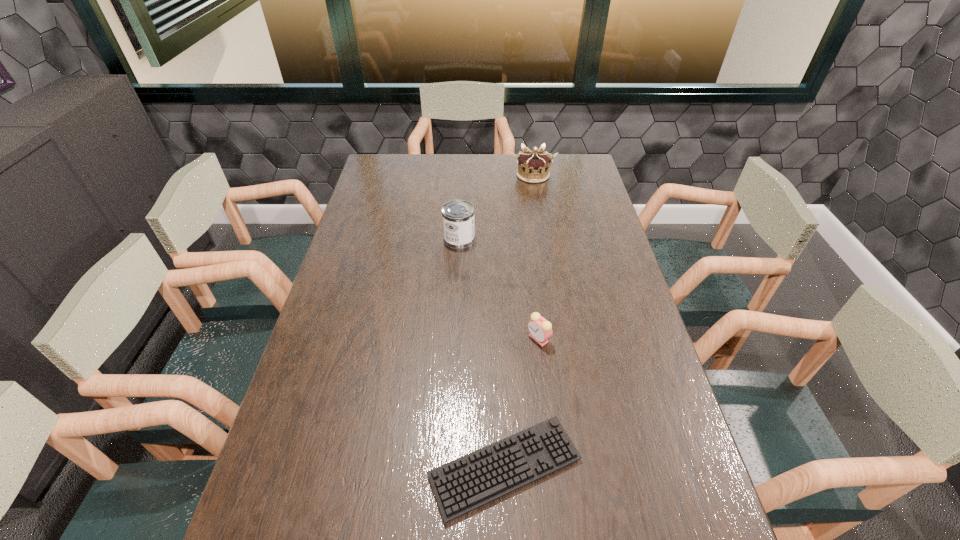
You are a GUI agent. You are given a task and a screenshot of the screen. Output one action in this format:
    pyautogui.click(x=<x>, y=<y>)
    Task: Click on the unoccupied area between the alarm clock and the third nearest object
    The height and width of the screenshot is (540, 960).
    Given the screenshot: What is the action you would take?
    pyautogui.click(x=499, y=289)

Find the location of a particular element. The image size is (960, 540). vacant area that lies between the can and the farthest object is located at coordinates (496, 207).

Locate an element on the screen. free space between the computer keyboard and the alarm clock is located at coordinates (522, 403).

Locate an element on the screen. Image resolution: width=960 pixels, height=540 pixels. vacant area that lies between the third nearest object and the crown is located at coordinates (496, 207).

This screenshot has height=540, width=960. What are the coordinates of `vacant area between the second nearest object and the second farthest object` in the screenshot? It's located at (499, 289).

In order to click on vacant space that is in between the farthest object and the nearest object in this screenshot , I will do `click(519, 321)`.

Where is `free spot between the crown and the alarm clock`? free spot between the crown and the alarm clock is located at coordinates (536, 256).

Where is `vacant area between the can and the third tallest object`? The height and width of the screenshot is (540, 960). vacant area between the can and the third tallest object is located at coordinates (499, 289).

Locate an element on the screen. The height and width of the screenshot is (540, 960). object that is the second closest to the crown is located at coordinates (540, 329).

What are the coordinates of `object that is the third closest one to the crown` in the screenshot? It's located at (473, 480).